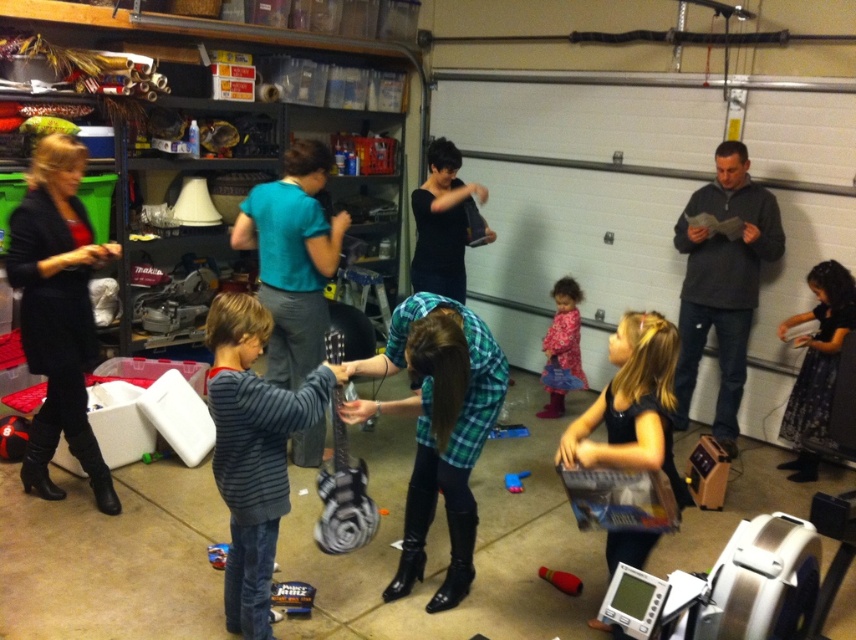
How far apart are black leather jacket at left and striped cotton shirt at center?

The distance of black leather jacket at left from striped cotton shirt at center is 1.20 meters.

Can you confirm if black leather jacket at left is thinner than striped cotton shirt at center?

In fact, black leather jacket at left might be wider than striped cotton shirt at center.

This screenshot has width=856, height=640. Find the location of `black leather jacket at left`. black leather jacket at left is located at coordinates (58, 312).

In the scene shown: Between dark blue floral dress at right and rubberized plastic toy at center, which one is positioned higher?

Positioned higher is dark blue floral dress at right.

Is dark blue floral dress at right to the left of rubberized plastic toy at center from the viewer's perspective?

In fact, dark blue floral dress at right is to the right of rubberized plastic toy at center.

Is point (810, 333) positioned before point (551, 573)?

No, it is behind (551, 573).

You are a GUI agent. You are given a task and a screenshot of the screen. Output one action in this format:
    pyautogui.click(x=<x>, y=<y>)
    Task: Click on the dark blue floral dress at right
    This screenshot has height=640, width=856.
    Given the screenshot: What is the action you would take?
    pyautogui.click(x=816, y=365)

Between point (693, 228) and point (308, 600), which one is positioned behind?

Positioned behind is point (693, 228).

Between dark gray sweater at right and blue plastic toy at center, which one has more height?

Standing taller between the two is dark gray sweater at right.

Between point (726, 264) and point (305, 612), which one is positioned in front?

Point (305, 612) is in front.

At what (x,y) coordinates should I click in order to perform the action: click on dark gray sweater at right. Please return your answer as a coordinate pair (x, y). Looking at the image, I should click on (722, 284).